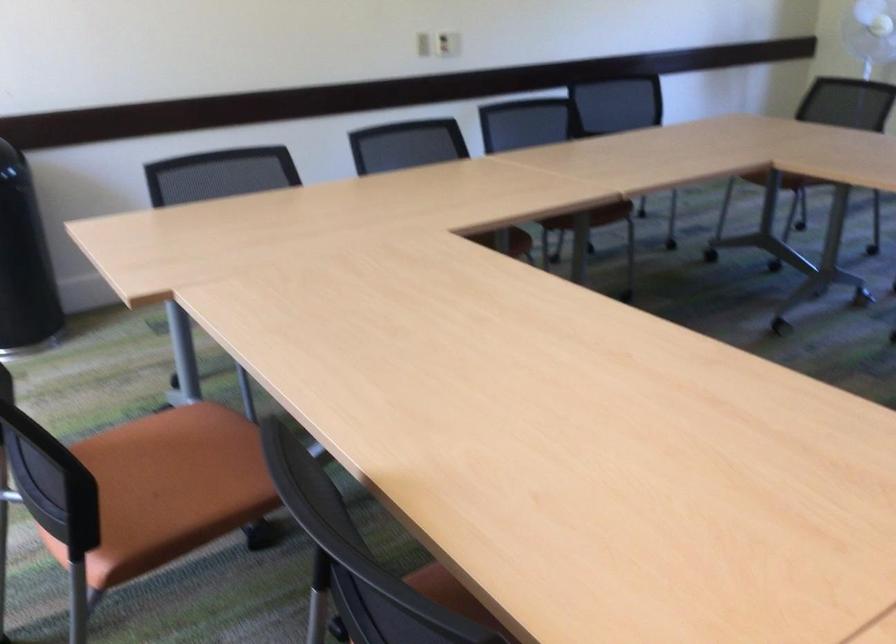
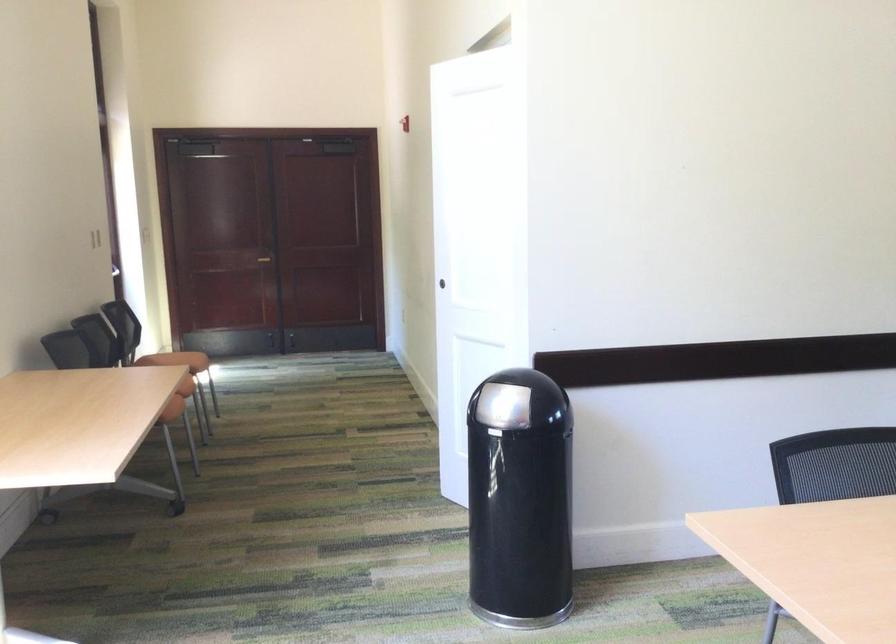
Question: The camera is either moving clockwise (left) or counter-clockwise (right) around the object. The first image is from the beginning of the video and the second image is from the end. Is the camera moving left or right when shooting the video?

Choices:
 (A) Left
 (B) Right

Answer: (B)